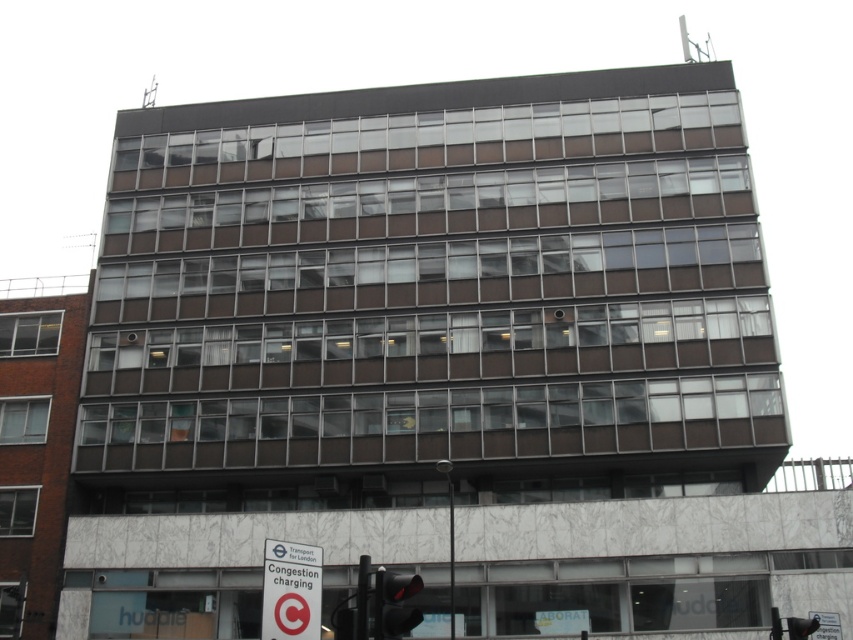
You are a pedestrian standing at the crosswalk in front of the multi story office building. You want to cross the street but need to wait until the traffic light turns green. How far apart are the white plastic sign at lower center and the red glass traffic light at lower center?

The distance between the white plastic sign at lower center and the red glass traffic light at lower center is 5.97 meters.

You are a pedestrian standing at the crosswalk in front of the office building. You see the white plastic sign at lower center and the red glass traffic light at lower center. Which object is positioned lower in relation to the other?

The white plastic sign at lower center is located below the red glass traffic light at lower center, so the white plastic sign at lower center is positioned lower than the red glass traffic light at lower center.

You are a delivery driver approaching the office building and need to know the distance between the white plastic sign at lower center and the camera. Can you confirm the distance?

The distance between the white plastic sign at lower center and the camera is 27.55 meters.